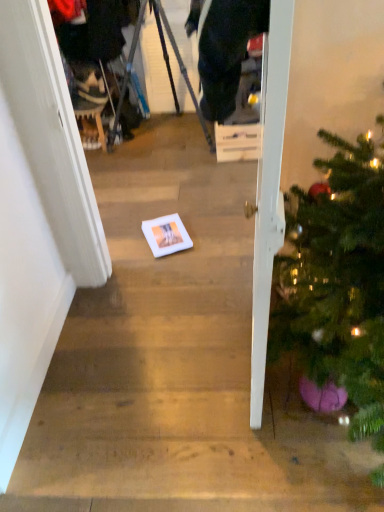
Image resolution: width=384 pixels, height=512 pixels. Identify the location of vacant area that lies in front of white glossy door at right. (256, 438).